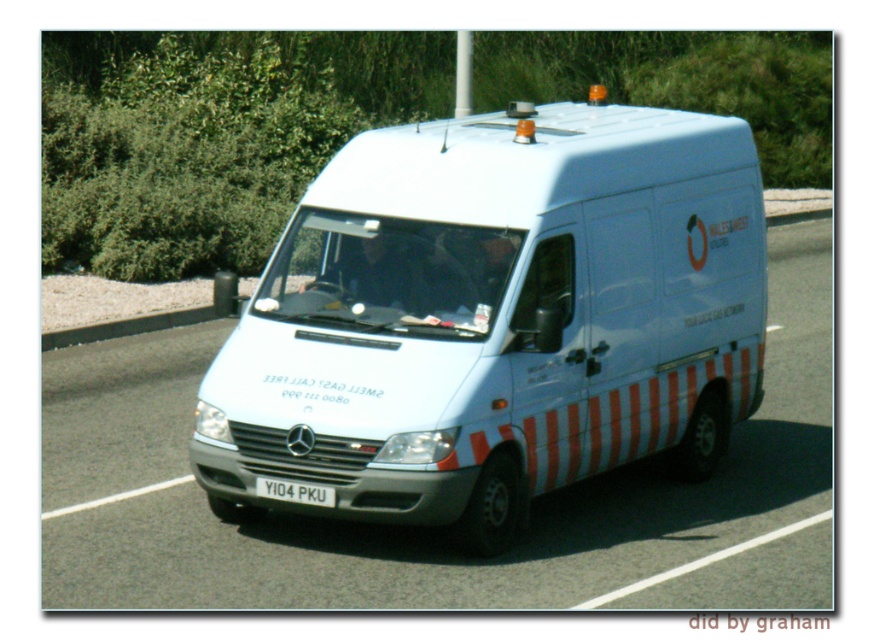
In the scene shown: Can you confirm if white glossy van at center is wider than black plastic license plate at center?

Yes.

Can you confirm if white glossy van at center is positioned to the right of black plastic license plate at center?

Indeed, white glossy van at center is positioned on the right side of black plastic license plate at center.

Is point (463, 524) in front of point (320, 497)?

No, (463, 524) is behind (320, 497).

Find the location of a particular element. white glossy van at center is located at coordinates (496, 317).